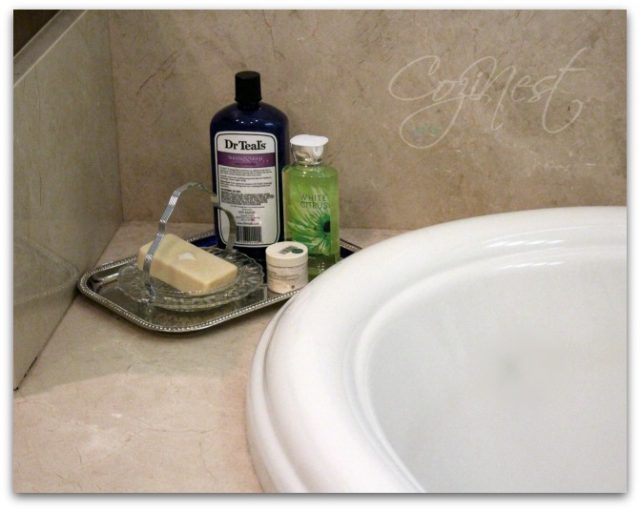
This screenshot has height=510, width=640. What are the coordinates of `bottle` in the screenshot? It's located at (271, 118).